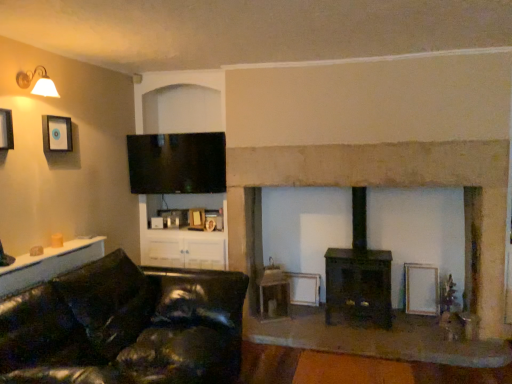
The height and width of the screenshot is (384, 512). I want to click on unoccupied area in front of wooden table at center, so click(x=278, y=330).